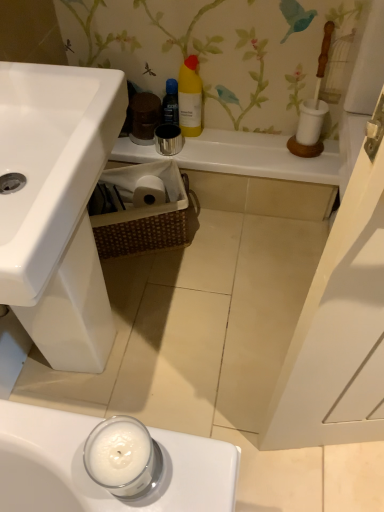
At what (x,y) coordinates should I click in order to perform the action: click on free space to the right of yellow plastic bottle at upper center. Please return your answer as a coordinate pair (x, y). Looking at the image, I should click on (239, 138).